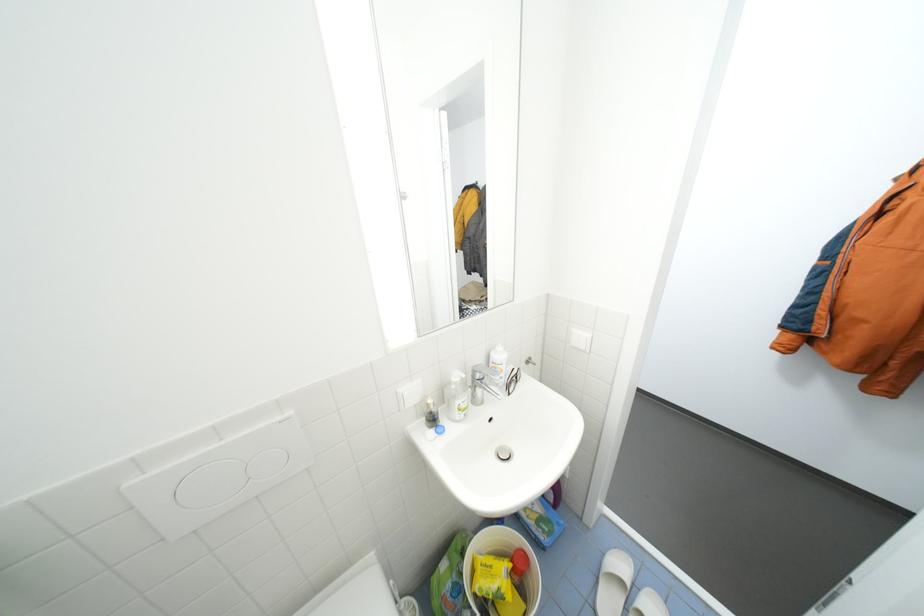
Find where to lift the silver faucet handle. Please return your answer as a coordinate pair (x, y).

(485, 382)